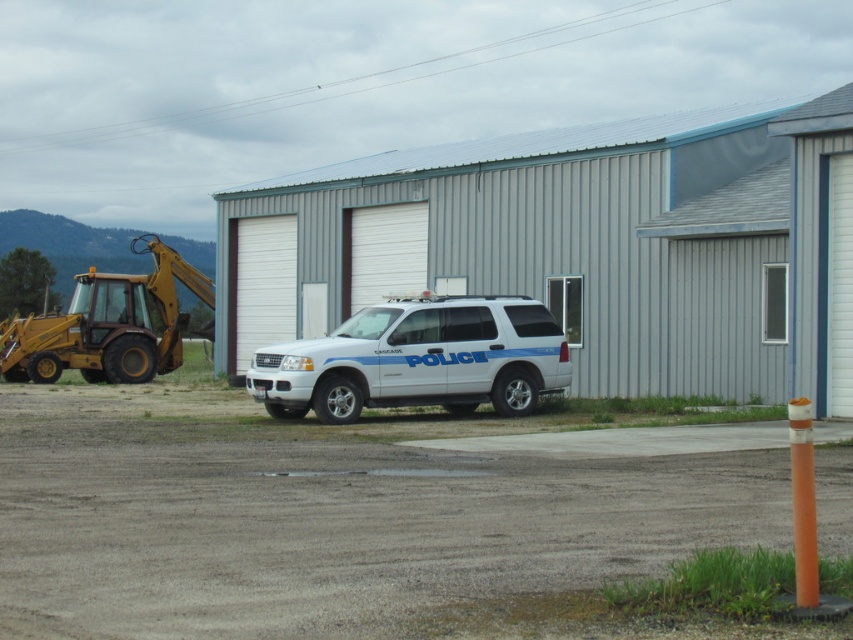
Question: Which of the following is the farthest from the observer?

Choices:
 (A) (195, 280)
 (B) (466, 387)

Answer: (A)

Question: Is white matte police car at center to the left of yellow metallic excavator at left from the viewer's perspective?

Choices:
 (A) no
 (B) yes

Answer: (A)

Question: Can you confirm if white matte police car at center is wider than yellow metallic excavator at left?

Choices:
 (A) no
 (B) yes

Answer: (A)

Question: Which of the following is the closest to the observer?

Choices:
 (A) (114, 285)
 (B) (540, 381)

Answer: (B)

Question: Is white matte police car at center bigger than yellow metallic excavator at left?

Choices:
 (A) no
 (B) yes

Answer: (A)

Question: Among these points, which one is farthest from the camera?

Choices:
 (A) (509, 394)
 (B) (154, 349)

Answer: (B)